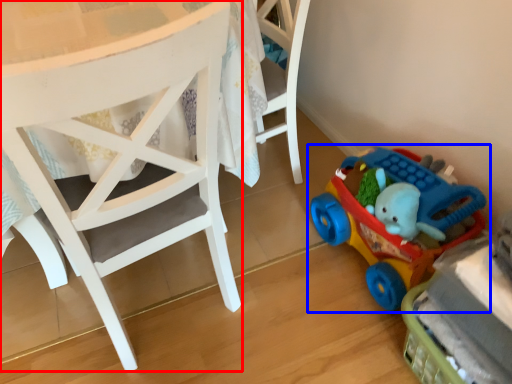
Question: Which object appears closest to the camera in this image, chair (highlighted by a red box) or toy (highlighted by a blue box)?

Choices:
 (A) chair
 (B) toy

Answer: (A)